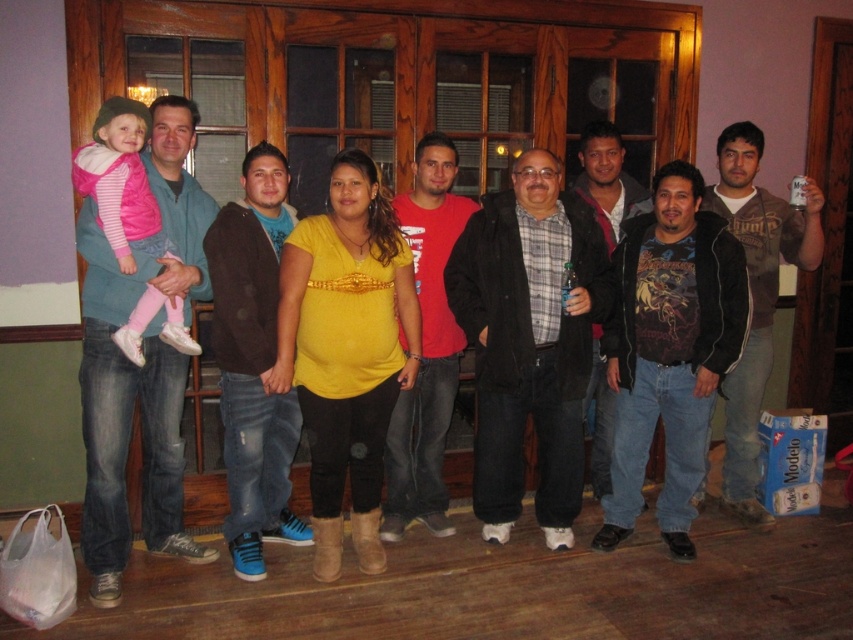
You are standing at the point labeled point (653, 298) and want to walk to the exit door located at point (242, 436). Is there any obstruction between your current position and the door?

Point (653, 298) is behind point (242, 436), so there is an obstruction between your current position and the door.

You are a photographer adjusting the lighting for a group photo. You notice the yellow matte shirt at center and the dark blue jeans at center. Which clothing item requires more light to ensure it stands out in the photo?

The yellow matte shirt at center has a smaller size compared to dark blue jeans at center, so it might require more focused lighting to ensure its visibility and color pop in the photo.

Looking at this image, you are a photographer standing 1.5 meters away from the camera. You want to take a photo of the yellow matte shirt at center. Is the camera within your reach?

The yellow matte shirt at center is 2.81 meters away from the camera. Since you are 1.5 meters away from the camera, the total distance between you and the shirt would be 4.31 meters. This distance might be too far for comfortable reach, so adjusting your position closer to the shirt or the camera would be advisable.